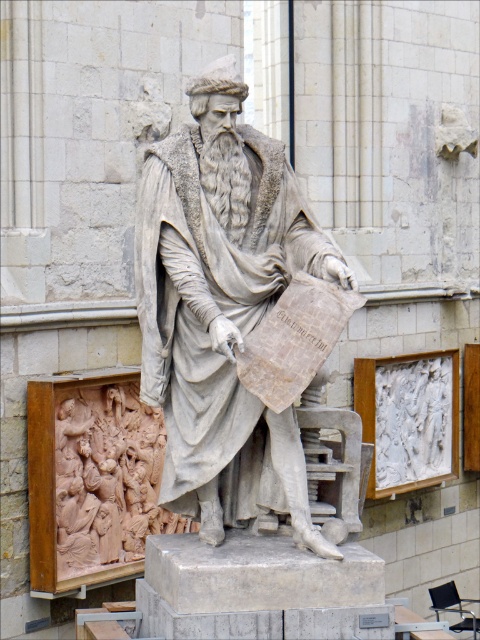
Question: Does gray stone statue at center have a smaller size compared to light brown wood carving at lower left?

Choices:
 (A) no
 (B) yes

Answer: (B)

Question: Which object appears closest to the camera in this image?

Choices:
 (A) light brown wood carving at lower left
 (B) gray stone statue at center

Answer: (B)

Question: Which object is farther from the camera taking this photo?

Choices:
 (A) gray stone statue at center
 (B) light brown wood carving at lower left

Answer: (B)

Question: Can you confirm if gray stone statue at center is thinner than light brown wood carving at lower left?

Choices:
 (A) no
 (B) yes

Answer: (B)

Question: Can you confirm if gray stone statue at center is smaller than light brown wood carving at lower left?

Choices:
 (A) no
 (B) yes

Answer: (B)